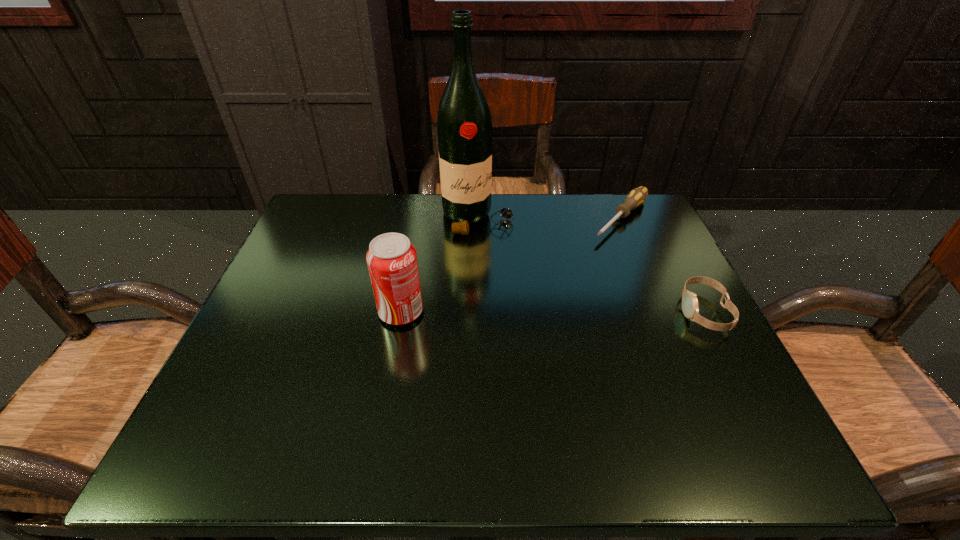
Find the location of `object that is the second closest one to the tallest object`. object that is the second closest one to the tallest object is located at coordinates (392, 262).